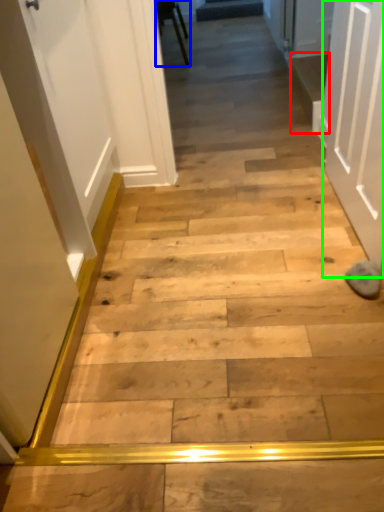
Question: Based on their relative distances, which object is farther from stairwell (highlighted by a red box)? Choose from furniture (highlighted by a blue box) and door (highlighted by a green box).

Choices:
 (A) furniture
 (B) door

Answer: (A)